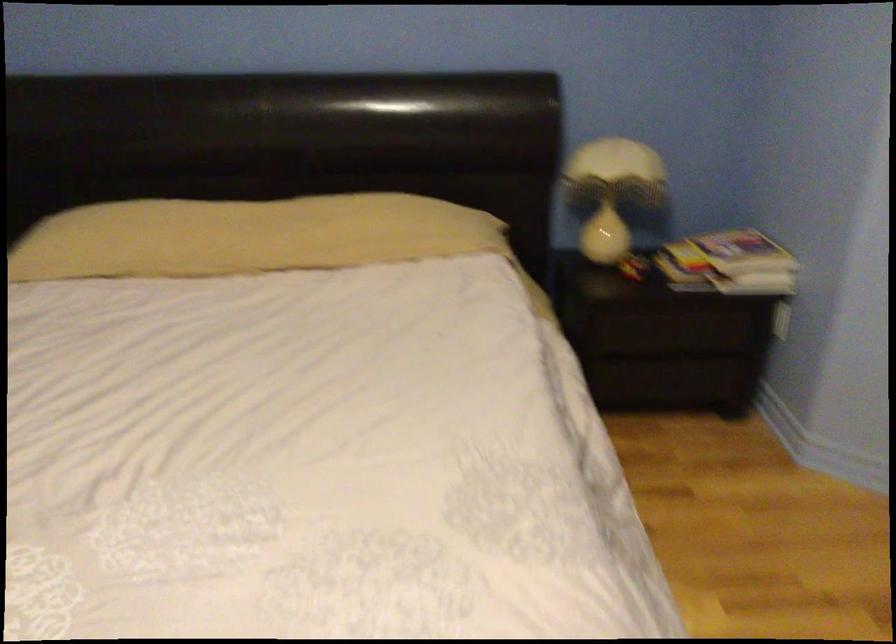
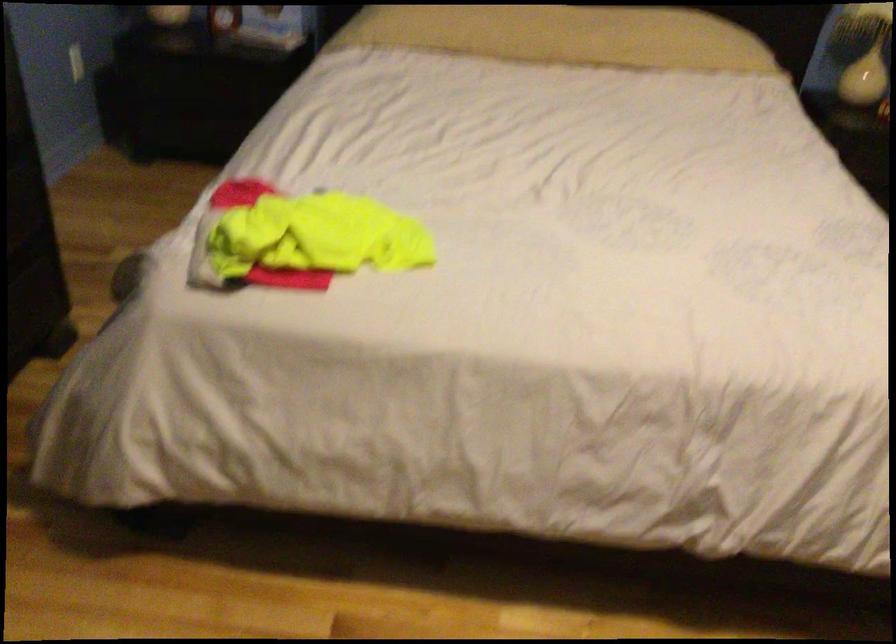
In a continuous first-person perspective shot, in which direction is the camera moving?

The cameraman moved toward left, backward.